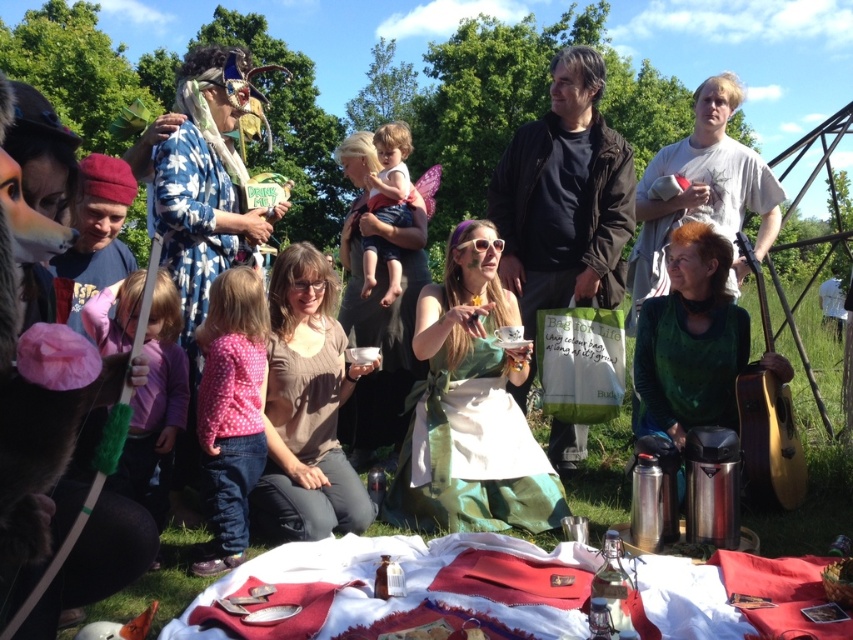
Question: Can you confirm if green satin dress at center is positioned below green velvet dress at center?

Choices:
 (A) no
 (B) yes

Answer: (B)

Question: Which of the following is the farthest from the observer?

Choices:
 (A) green velvet dress at center
 (B) green satin dress at center

Answer: (A)

Question: Which point is farther to the camera?

Choices:
 (A) (242, 556)
 (B) (485, 385)

Answer: (B)

Question: Is green velvet dress at center to the left of pink dotted shirt at lower left from the viewer's perspective?

Choices:
 (A) yes
 (B) no

Answer: (B)

Question: Does green satin dress at center have a lesser width compared to pink dotted shirt at lower left?

Choices:
 (A) no
 (B) yes

Answer: (A)

Question: Estimate the real-world distances between objects in this image. Which object is closer to the pink dotted shirt at lower left?

Choices:
 (A) green satin dress at center
 (B) brown cotton shirt at center
 (C) green velvet dress at center

Answer: (B)